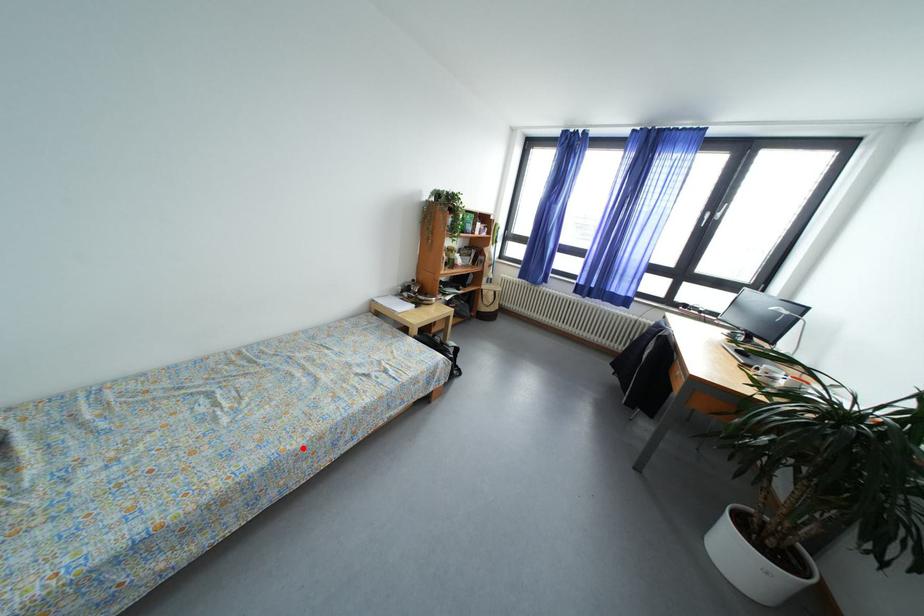
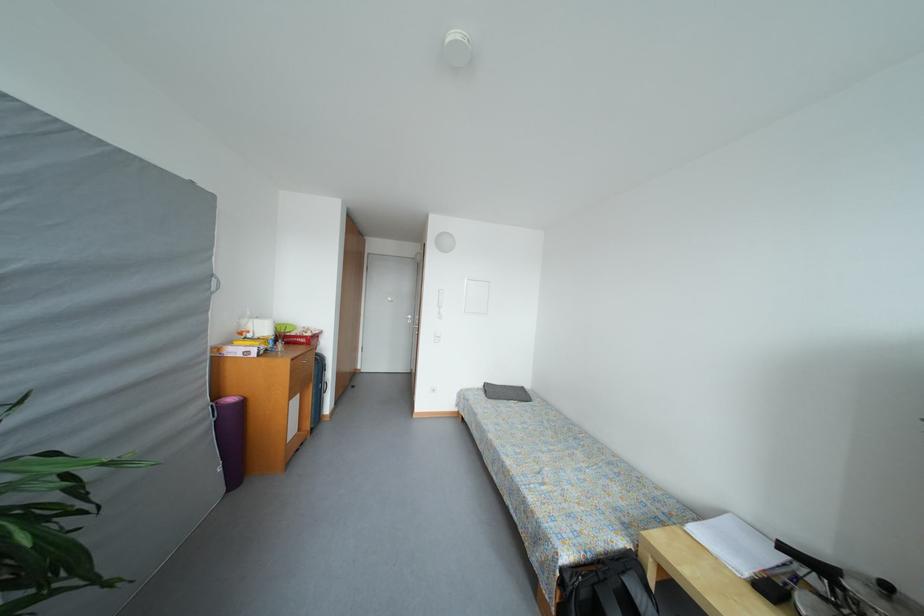
The point at the highlighted location is marked in the first image. Where is the corresponding point in the second image?

(496, 440)